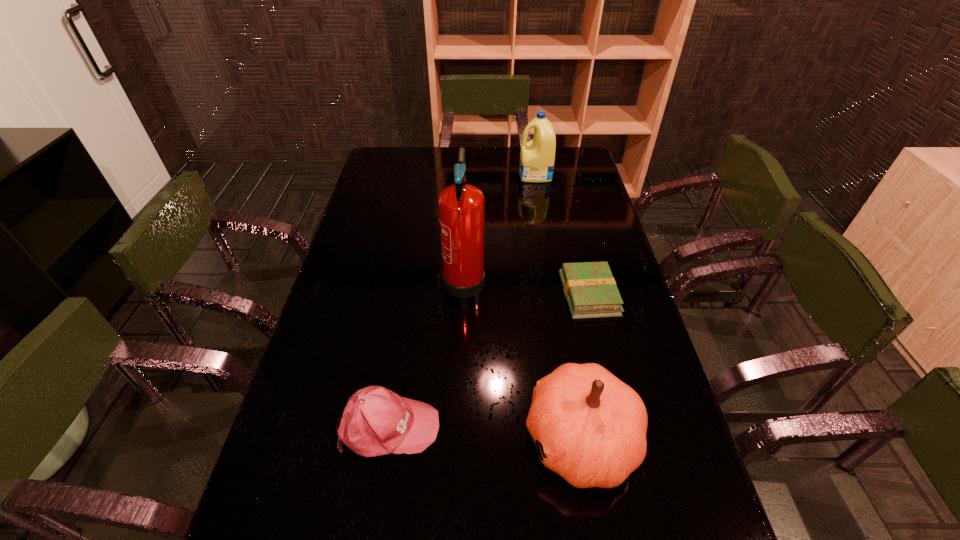
At what (x,y) coordinates should I click in order to perform the action: click on vacant area between the fire extinguisher and the shortest object. Please return your answer as a coordinate pair (x, y). The image size is (960, 540). Looking at the image, I should click on (526, 285).

The image size is (960, 540). Find the location of `free spot between the fire extinguisher and the fourth tallest object`. free spot between the fire extinguisher and the fourth tallest object is located at coordinates (426, 350).

This screenshot has width=960, height=540. What are the coordinates of `free space between the shortest object and the farthest object` in the screenshot? It's located at (562, 234).

Identify which object is the third closest to the book. Please provide its 2D coordinates. Your answer should be formatted as a tuple, i.e. [(x, y)], where the tuple contains the x and y coordinates of a point satisfying the conditions above.

[(376, 421)]

Locate an element on the screen. This screenshot has width=960, height=540. object that is the fourth closest one to the shortest object is located at coordinates (537, 156).

Locate an element on the screen. The width and height of the screenshot is (960, 540). vacant space that satisfies the following two spatial constraints: 1. on the front side of the shortest object; 2. at the front of the baseball cap with the brim is located at coordinates (621, 426).

You are a GUI agent. You are given a task and a screenshot of the screen. Output one action in this format:
    pyautogui.click(x=<x>, y=<y>)
    Task: Click on the free space that satisfies the following two spatial constraints: 1. on the label of the book; 2. on the right side of the detergent
    The height and width of the screenshot is (540, 960).
    Given the screenshot: What is the action you would take?
    pyautogui.click(x=556, y=294)

Find the location of `free space that satisfies the following two spatial constraints: 1. on the label of the book; 2. on the right side of the farthest object`. free space that satisfies the following two spatial constraints: 1. on the label of the book; 2. on the right side of the farthest object is located at coordinates tap(556, 294).

The height and width of the screenshot is (540, 960). I want to click on free location that satisfies the following two spatial constraints: 1. on the back side of the book; 2. on the label of the farthest object, so click(x=560, y=175).

Locate an element on the screen. This screenshot has width=960, height=540. vacant space that satisfies the following two spatial constraints: 1. on the label of the book; 2. on the right side of the farthest object is located at coordinates (556, 294).